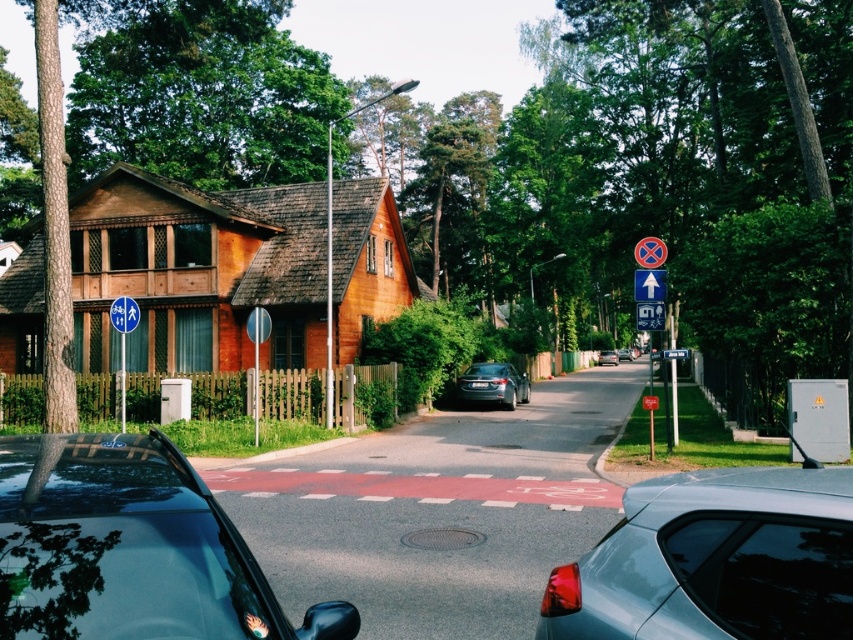
Question: Estimate the real-world distances between objects in this image. Which object is closer to the shiny black car at lower left?

Choices:
 (A) shiny silver sedan at center
 (B) blue plastic bus stop sign at upper center
 (C) matte gray car at center

Answer: (B)

Question: Which of these objects is positioned farthest from the blue plastic arrow at upper center?

Choices:
 (A) blue plastic bus stop sign at upper center
 (B) shiny black car at lower left
 (C) matte gray car at lower right

Answer: (B)

Question: Is metallic circular sign at center above blue plastic bus stop sign at upper center?

Choices:
 (A) no
 (B) yes

Answer: (B)

Question: Does green leafy tree at upper left have a smaller size compared to blue plastic arrow at upper center?

Choices:
 (A) no
 (B) yes

Answer: (A)

Question: Does metallic circular sign at center have a lesser width compared to blue plastic bus stop sign at upper center?

Choices:
 (A) no
 (B) yes

Answer: (B)

Question: Which is nearer to the shiny black car at lower left?

Choices:
 (A) matte gray car at lower right
 (B) green leafy tree at upper left

Answer: (A)